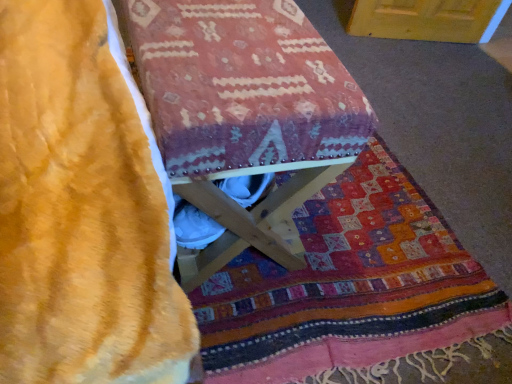
Locate an element on the screen. The image size is (512, 384). wooden stool at center is located at coordinates (243, 111).

What do you see at coordinates (243, 111) in the screenshot? I see `wooden stool at center` at bounding box center [243, 111].

Locate an element on the screen. Image resolution: width=512 pixels, height=384 pixels. velvety yellow blanket at lower left is located at coordinates (348, 285).

Image resolution: width=512 pixels, height=384 pixels. What do you see at coordinates (348, 285) in the screenshot?
I see `velvety yellow blanket at lower left` at bounding box center [348, 285].

At what (x,y) coordinates should I click in order to perform the action: click on wooden stool at center. Please return your answer as a coordinate pair (x, y). This screenshot has height=384, width=512. Looking at the image, I should click on (243, 111).

Considering the relative positions of wooden stool at center and velvety yellow blanket at lower left in the image provided, is wooden stool at center to the right of velvety yellow blanket at lower left from the viewer's perspective?

Incorrect, wooden stool at center is not on the right side of velvety yellow blanket at lower left.

Considering the positions of objects wooden stool at center and velvety yellow blanket at lower left in the image provided, who is in front, wooden stool at center or velvety yellow blanket at lower left?

wooden stool at center.

Does point (262, 107) appear closer or farther from the camera than point (430, 232)?

Point (262, 107) is closer to the camera than point (430, 232).

From the image's perspective, which one is positioned lower, wooden stool at center or velvety yellow blanket at lower left?

velvety yellow blanket at lower left.

Based on the photo, from a real-world perspective, is wooden stool at center beneath velvety yellow blanket at lower left?

No, from a real-world perspective, wooden stool at center is not under velvety yellow blanket at lower left.

Looking at this image, which of these two, wooden stool at center or velvety yellow blanket at lower left, is wider?

velvety yellow blanket at lower left is wider.

Who is taller, wooden stool at center or velvety yellow blanket at lower left?

wooden stool at center is taller.

Which of these two, wooden stool at center or velvety yellow blanket at lower left, is bigger?

Bigger between the two is wooden stool at center.

Is wooden stool at center inside or outside of velvety yellow blanket at lower left?

wooden stool at center is spatially situated outside velvety yellow blanket at lower left.

Would you say wooden stool at center is a long distance from velvety yellow blanket at lower left?

wooden stool at center is near velvety yellow blanket at lower left, not far away.

Is velvety yellow blanket at lower left at the back of wooden stool at center?

No.

I want to click on blanket below the wooden stool at center (from a real-world perspective), so click(348, 285).

Considering the positions of objects velvety yellow blanket at lower left and wooden stool at center in the image provided, who is more to the right, velvety yellow blanket at lower left or wooden stool at center?

velvety yellow blanket at lower left is more to the right.

Between velvety yellow blanket at lower left and wooden stool at center, which one is positioned behind?

velvety yellow blanket at lower left is further away from the camera.

Between point (335, 218) and point (237, 174), which one is positioned in front?

The point (237, 174) is closer to the camera.

From the image's perspective, is velvety yellow blanket at lower left on top of wooden stool at center?

No, from the image's perspective, velvety yellow blanket at lower left is not over wooden stool at center.

From a real-world perspective, is velvety yellow blanket at lower left physically located above or below wooden stool at center?

velvety yellow blanket at lower left is situated lower than wooden stool at center in the real world.

Considering the sizes of velvety yellow blanket at lower left and wooden stool at center in the image, is velvety yellow blanket at lower left wider or thinner than wooden stool at center?

Considering their sizes, velvety yellow blanket at lower left looks broader than wooden stool at center.

Is velvety yellow blanket at lower left taller than wooden stool at center?

No, velvety yellow blanket at lower left is not taller than wooden stool at center.

Based on their sizes in the image, would you say velvety yellow blanket at lower left is bigger or smaller than wooden stool at center?

Considering their sizes, velvety yellow blanket at lower left takes up less space than wooden stool at center.

Would you say velvety yellow blanket at lower left is outside wooden stool at center?

That's correct, velvety yellow blanket at lower left is outside of wooden stool at center.

In the scene shown: Is velvety yellow blanket at lower left placed right next to wooden stool at center?

velvety yellow blanket at lower left and wooden stool at center are clearly separated.

Could you tell me if velvety yellow blanket at lower left is turned towards wooden stool at center?

No, velvety yellow blanket at lower left is not oriented towards wooden stool at center.

Identify the location of furniture in front of the velvety yellow blanket at lower left. This screenshot has width=512, height=384. (243, 111).

Where is `blanket located below the wooden stool at center (from the image's perspective)`? blanket located below the wooden stool at center (from the image's perspective) is located at coordinates (348, 285).

Find the location of a particular element. The image size is (512, 384). blanket that is under the wooden stool at center (from a real-world perspective) is located at coordinates (348, 285).